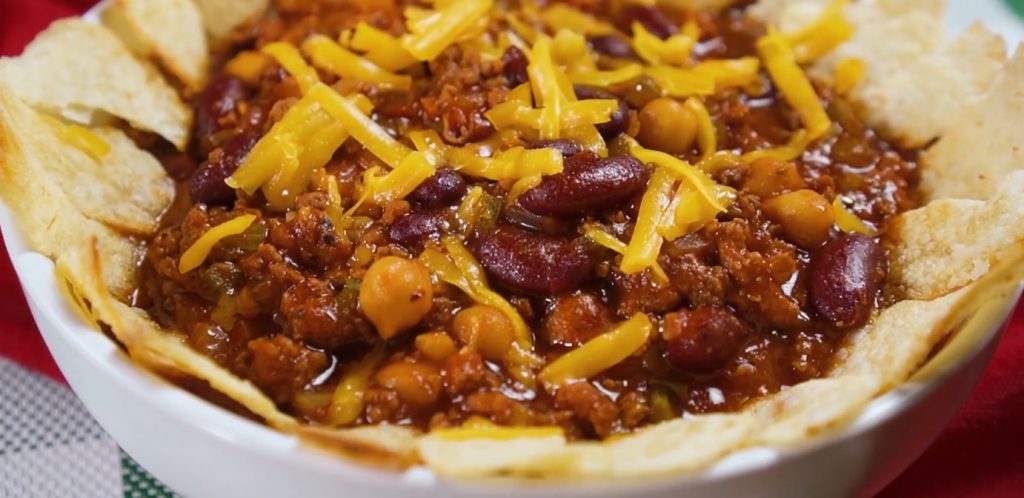
You are a GUI agent. You are given a task and a screenshot of the screen. Output one action in this format:
    pyautogui.click(x=<x>, y=<y>)
    Task: Click on the red towel
    
    Given the screenshot: What is the action you would take?
    pyautogui.click(x=997, y=435)